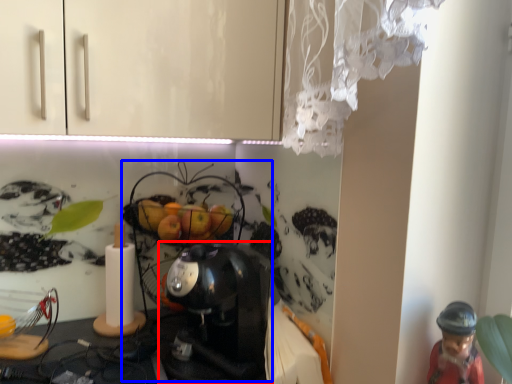
Question: Among these objects, which one is nearest to the camera, coffee maker (highlighted by a red box) or toy (highlighted by a blue box)?

Choices:
 (A) coffee maker
 (B) toy

Answer: (A)